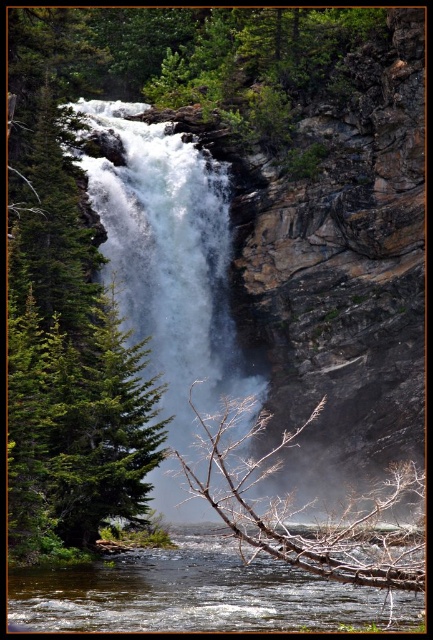
Does point (158, 182) lie in front of point (90, 611)?

That is False.

Based on the photo, between white frothy water at center and clear water at center, which one has less height?

Standing shorter between the two is clear water at center.

Which is behind, point (180, 356) or point (323, 596)?

The point (180, 356) is more distant.

You are a GUI agent. You are given a task and a screenshot of the screen. Output one action in this format:
    pyautogui.click(x=<x>, y=<y>)
    Task: Click on the white frothy water at center
    The height and width of the screenshot is (640, 433).
    Given the screenshot: What is the action you would take?
    pyautogui.click(x=168, y=262)